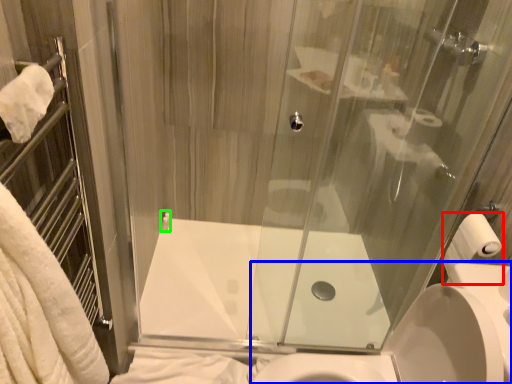
Question: Estimate the real-world distances between objects in this image. Which object is farther from toilet paper (highlighted by a red box), sink (highlighted by a blue box) or towel bar (highlighted by a green box)?

Choices:
 (A) sink
 (B) towel bar

Answer: (B)